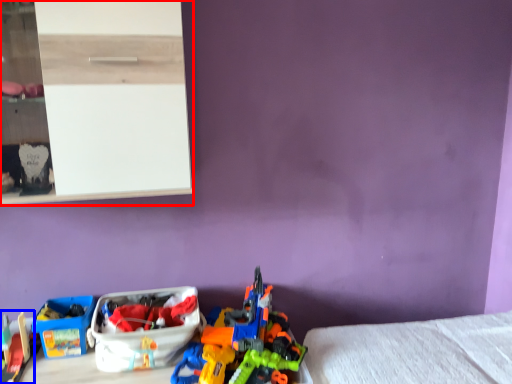
Question: Which point is further to the camera, shelf (highlighted by a red box) or toy (highlighted by a blue box)?

Choices:
 (A) shelf
 (B) toy

Answer: (B)